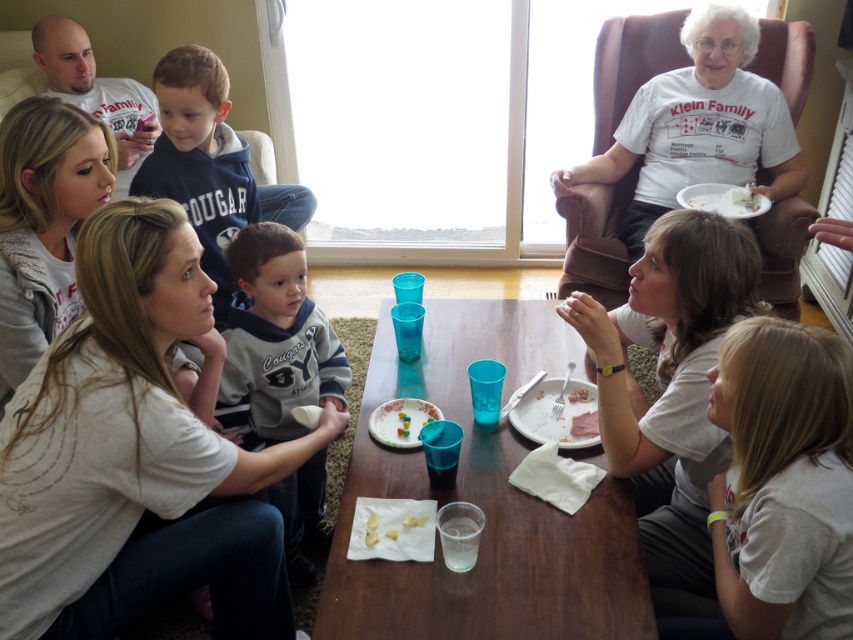
Who is more distant from viewer, [221,86] or [728,189]?

Positioned behind is point [728,189].

Locate an element on the screen. The image size is (853, 640). dark blue hoodie at upper left is located at coordinates (200, 161).

Is point (154, 83) farther from viewer compared to point (737, 188)?

No, it is not.

Identify the location of dark blue hoodie at upper left. The image size is (853, 640). (200, 161).

Does smooth wooden table at center have a lesser height compared to translucent plastic plate at center?

Incorrect, smooth wooden table at center's height does not fall short of translucent plastic plate at center's.

Does smooth wooden table at center have a lesser width compared to translucent plastic plate at center?

In fact, smooth wooden table at center might be wider than translucent plastic plate at center.

Does point (358, 460) come closer to viewer compared to point (375, 422)?

Yes, point (358, 460) is closer to viewer.

Identify the location of smooth wooden table at center. The width and height of the screenshot is (853, 640). (483, 502).

Between point (576, 397) and point (404, 525), which one is positioned behind?

Point (576, 397)

Does point (589, 397) come closer to viewer compared to point (421, 518)?

No, (589, 397) is further to viewer.

Is point (579, 396) positioned after point (407, 516)?

Yes, it is.

You are a GUI agent. You are given a task and a screenshot of the screen. Output one action in this format:
    pyautogui.click(x=<x>, y=<y>)
    Task: Click on the hammy meat at upper center
    The height and width of the screenshot is (640, 853).
    Given the screenshot: What is the action you would take?
    pyautogui.click(x=578, y=394)